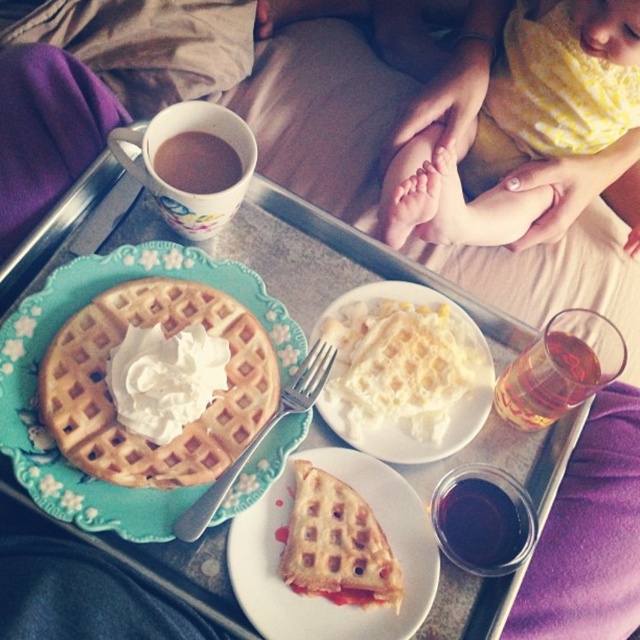
Question: Observing the image, what is the correct spatial positioning of golden brown waffle with whipped cream at left in reference to matte ceramic mug at upper center?

Choices:
 (A) below
 (B) above

Answer: (A)

Question: Which object appears farthest from the camera in this image?

Choices:
 (A) brown matte cup at upper center
 (B) white matte waffle at center

Answer: (B)

Question: Is golden brown waffle with whipped cream at left smaller than matte ceramic mug at upper center?

Choices:
 (A) yes
 (B) no

Answer: (A)

Question: Which point is closer to the camera taking this photo?

Choices:
 (A) (368, 493)
 (B) (556, 339)
 (C) (506, 540)

Answer: (A)

Question: Is golden brown waffle with whipped cream at left bigger than white matte waffle at center?

Choices:
 (A) yes
 (B) no

Answer: (A)

Question: Which point is closer to the camera?

Choices:
 (A) dark red liquid at lower right
 (B) matte ceramic mug at upper center
 (C) white matte plate at center
 (D) translucent glass at upper right

Answer: (C)